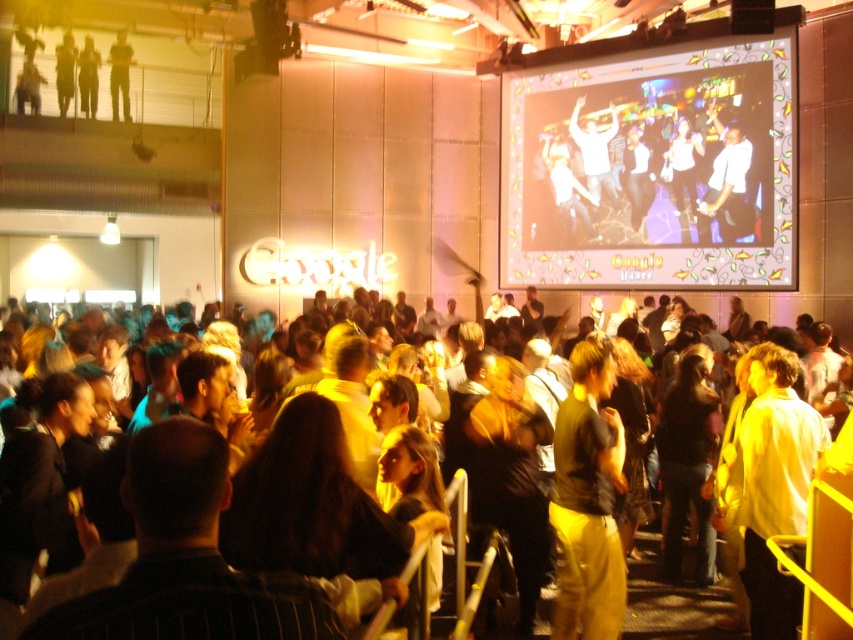
Question: Is yellow fabric shirt at center in front of white fabric shirt at upper center?

Choices:
 (A) no
 (B) yes

Answer: (B)

Question: Which of the following is the farthest from the observer?

Choices:
 (A) (730, 189)
 (B) (122, 65)
 (C) (657, 531)
 (D) (761, 493)

Answer: (B)

Question: Which is nearer to the white fabric shirt at upper center?

Choices:
 (A) yellow casual clothing at center
 (B) yellow fabric shirt at center

Answer: (A)

Question: Estimate the real-world distances between objects in this image. Which object is farther from the light brown leather jacket at upper left?

Choices:
 (A) matte black jacket at upper left
 (B) white matte shirt at right
 (C) white fabric shirt at upper center
 (D) yellow fabric shirt at center

Answer: (B)

Question: Can you confirm if white matte shirt at right is positioned below white fabric shirt at upper center?

Choices:
 (A) yes
 (B) no

Answer: (A)

Question: Is white matte shirt at right above white fabric shirt at upper center?

Choices:
 (A) no
 (B) yes

Answer: (A)